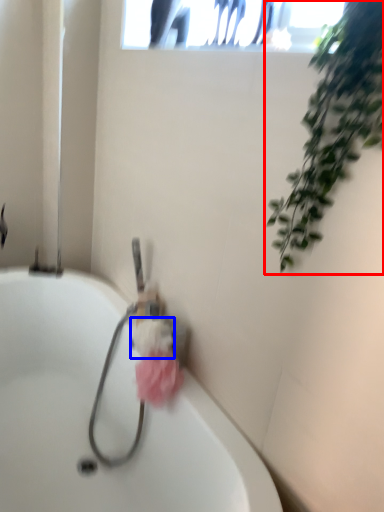
Question: Among these objects, which one is farthest to the camera, houseplant (highlighted by a red box) or flower (highlighted by a blue box)?

Choices:
 (A) houseplant
 (B) flower

Answer: (B)